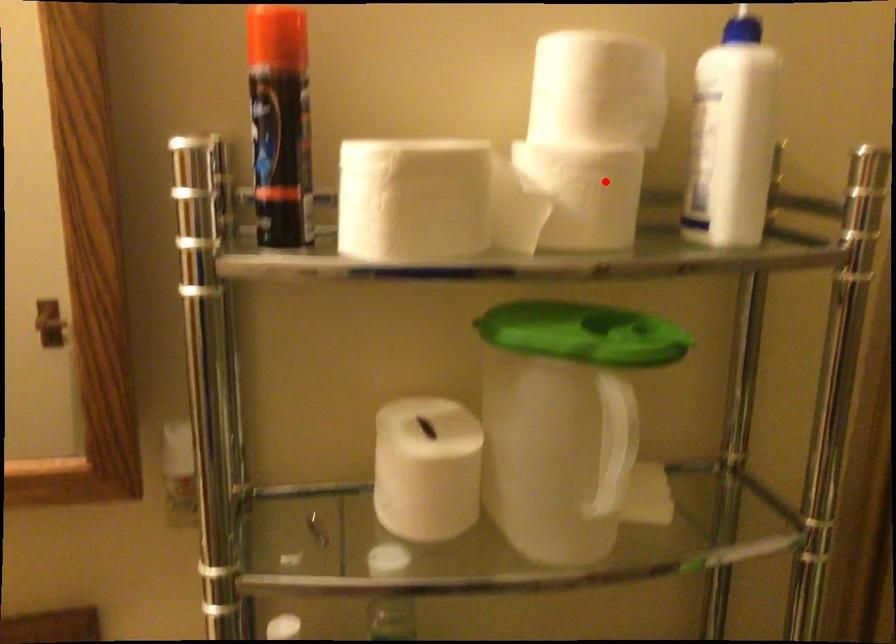
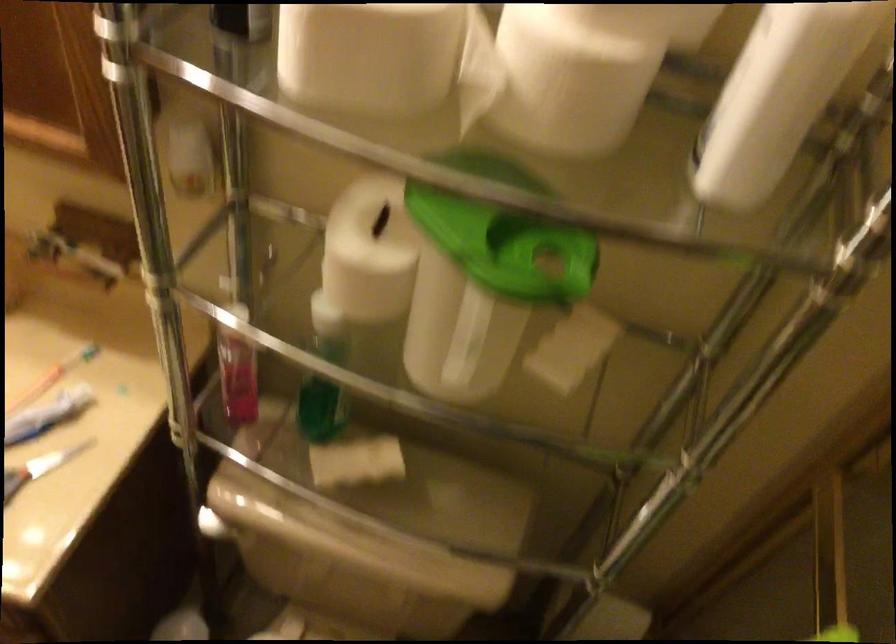
Locate, in the second image, the point that corresponds to the highlighted location in the first image.

(575, 73)